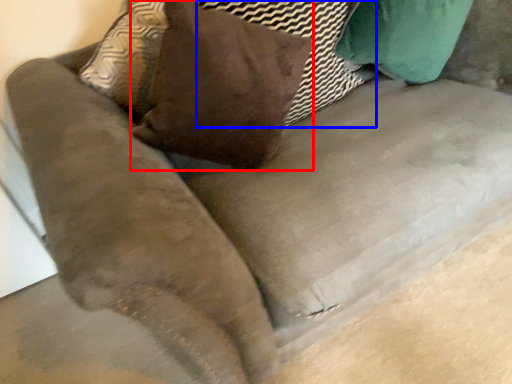
Question: Among these objects, which one is farthest to the camera, throw pillow (highlighted by a red box) or pillow (highlighted by a blue box)?

Choices:
 (A) throw pillow
 (B) pillow

Answer: (B)